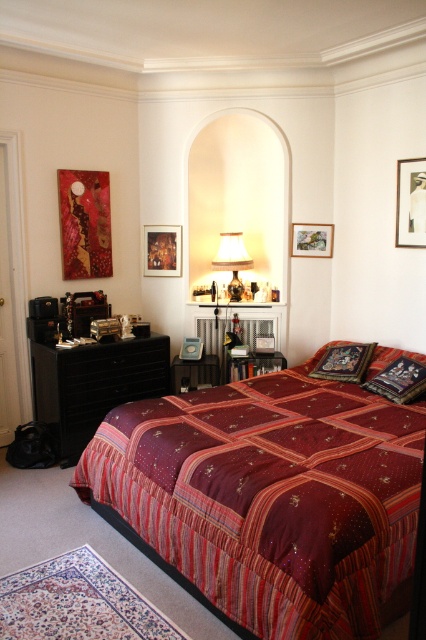
Question: Does embroidered silk pillow at center appear on the right side of wooden picture frame at center?

Choices:
 (A) yes
 (B) no

Answer: (A)

Question: Is matte glass lampshade at center to the right of wooden picture frame at center from the viewer's perspective?

Choices:
 (A) yes
 (B) no

Answer: (B)

Question: Which object is the farthest from the velvet-like floral pillow at center?

Choices:
 (A) matte gold picture frame at upper center
 (B) wooden picture frame at center
 (C) embroidered silk pillow at center

Answer: (A)

Question: Which point is farther to the camera?

Choices:
 (A) black glossy dresser at left
 (B) matte glass lampshade at center
 (C) embroidered silk pillow at center

Answer: (B)

Question: Is burgundy satin bed at center positioned in front of matte glass lampshade at center?

Choices:
 (A) yes
 (B) no

Answer: (A)

Question: Which point is closer to the camera?

Choices:
 (A) (81, 413)
 (B) (172, 257)
 (C) (239, 300)
 (D) (359, 355)

Answer: (D)